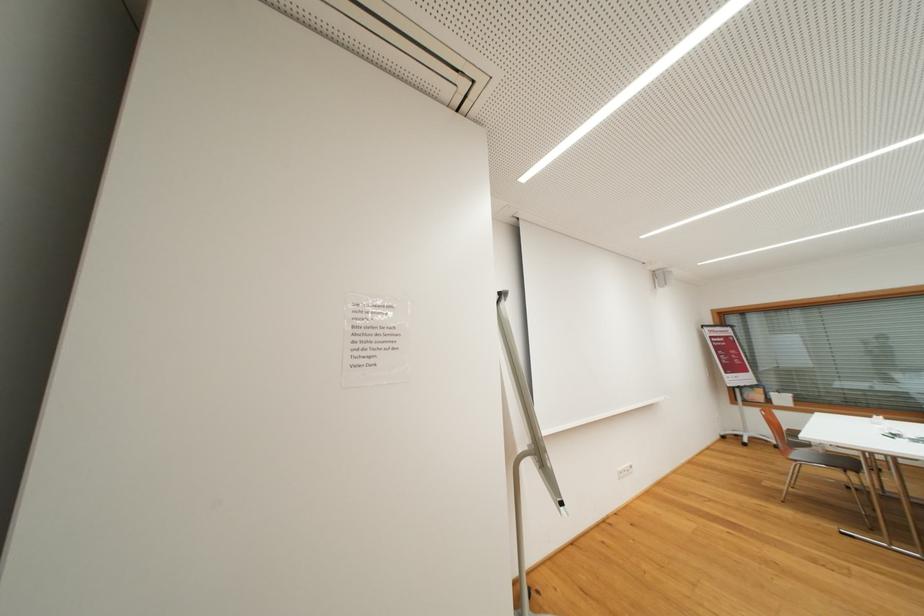
Image resolution: width=924 pixels, height=616 pixels. Describe the element at coordinates (562, 488) in the screenshot. I see `the whiteboard tray` at that location.